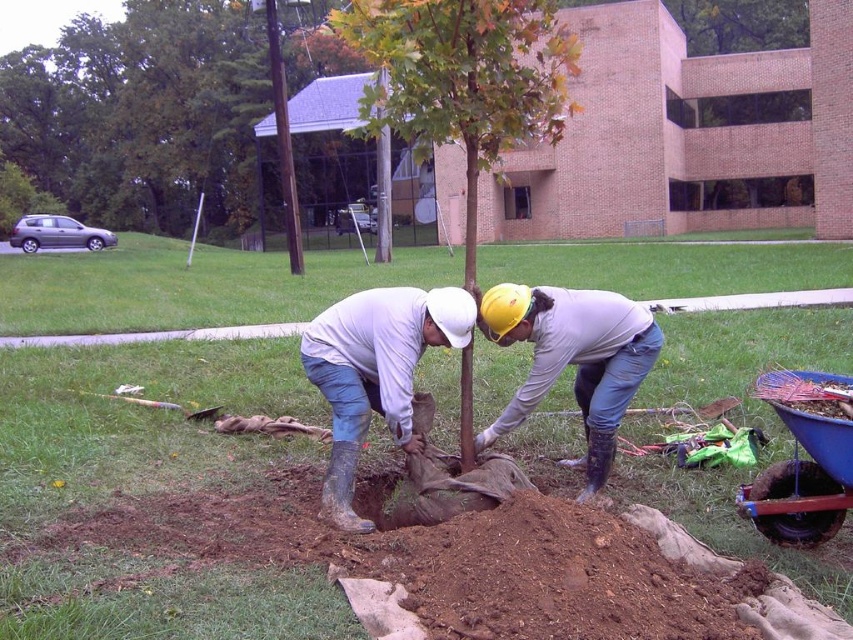
Who is more forward, [381,394] or [567,461]?

Point [381,394]

Describe the element at coordinates (375, 372) in the screenshot. I see `white matte helmet at center` at that location.

Describe the element at coordinates (375, 372) in the screenshot. The height and width of the screenshot is (640, 853). I see `white matte helmet at center` at that location.

The image size is (853, 640). I want to click on white matte helmet at center, so [x=375, y=372].

From the picture: Is green matte tree at center bigger than white matte helmet at center?

Yes.

Is the position of green matte tree at center less distant than that of white matte helmet at center?

That is True.

Is point (434, 10) closer to camera compared to point (395, 289)?

Yes, it is.

Locate an element on the screen. Image resolution: width=853 pixels, height=640 pixels. green matte tree at center is located at coordinates [x=463, y=77].

What do you see at coordinates (463, 77) in the screenshot?
I see `green matte tree at center` at bounding box center [463, 77].

In order to click on green matte tree at center in this screenshot , I will do `click(463, 77)`.